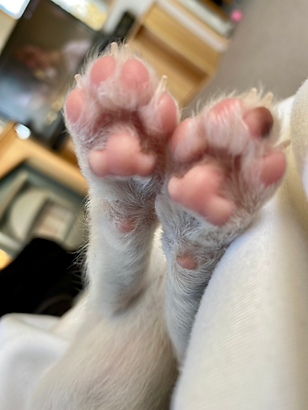
Find the location of `mantle`. mantle is located at coordinates (6, 137).